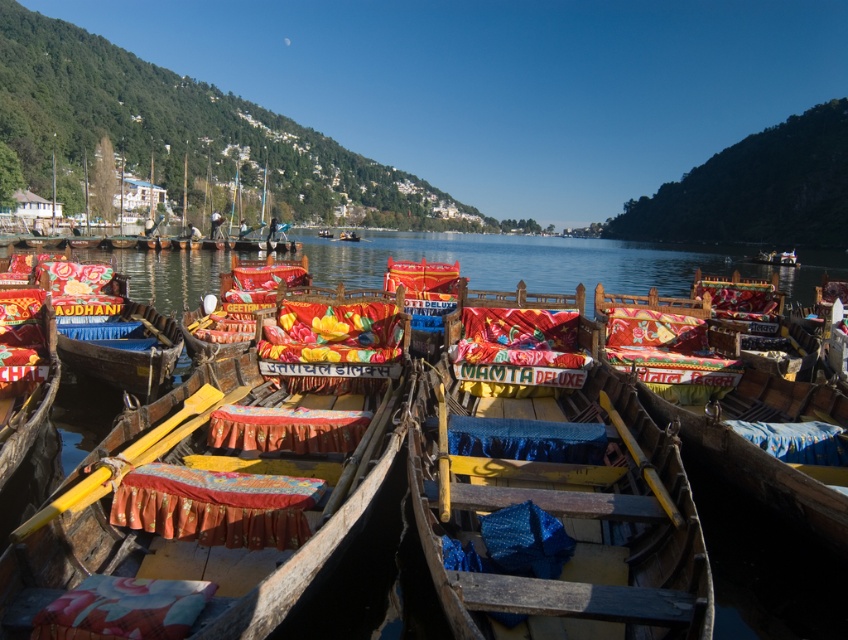
Is point (386, 429) farther from viewer compared to point (358, 257)?

No, (386, 429) is closer to viewer.

Between wooden boat at center and transparent water at center, which one is positioned lower?

Positioned lower is wooden boat at center.

What do you see at coordinates (201, 513) in the screenshot? Image resolution: width=848 pixels, height=640 pixels. I see `wooden boat at center` at bounding box center [201, 513].

Find the location of a particular element. The image size is (848, 640). wooden boat at center is located at coordinates (201, 513).

Does matte wooden boat at center have a smaller size compared to wooden boat at center?

Indeed, matte wooden boat at center has a smaller size compared to wooden boat at center.

Between matte wooden boat at center and wooden boat at center, which one has less height?

Standing shorter between the two is matte wooden boat at center.

Is point (640, 440) positioned in front of point (220, 531)?

No.

This screenshot has width=848, height=640. Find the location of `matte wooden boat at center`. matte wooden boat at center is located at coordinates (558, 508).

Who is shorter, matte wooden boat at center or transparent water at center?

matte wooden boat at center

Is matte wooden boat at center positioned behind transparent water at center?

No, matte wooden boat at center is in front of transparent water at center.

Between point (679, 596) and point (226, 260), which one is positioned in front?

Positioned in front is point (679, 596).

Where is `matte wooden boat at center`? The image size is (848, 640). matte wooden boat at center is located at coordinates (558, 508).